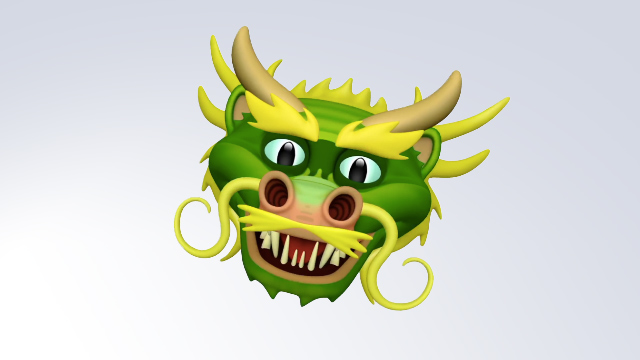
The height and width of the screenshot is (360, 640). I want to click on artwork, so click(x=406, y=212).